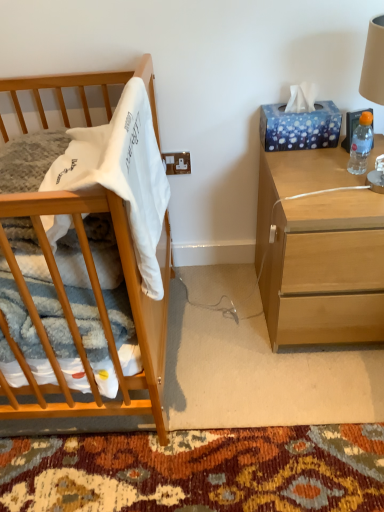
The image size is (384, 512). In order to click on vacant area that lies in front of blue glossy tissue box at upper right in this screenshot , I will do `click(308, 163)`.